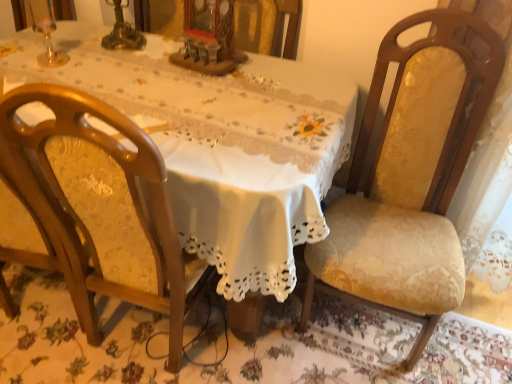
Image resolution: width=512 pixels, height=384 pixels. Find the location of `empty space that is ontop of white lace tablecloth at center`. empty space that is ontop of white lace tablecloth at center is located at coordinates (158, 92).